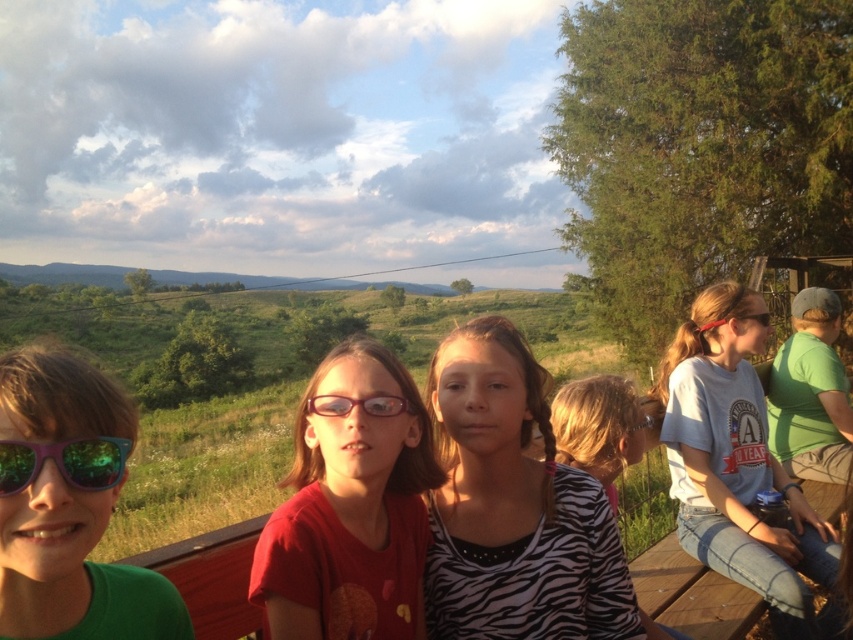
You are a photographer trying to capture a photo of the zebra print shirt at center and the matte green sunglasses at left. Since you want to ensure both are clearly visible, which object should you focus on first considering their sizes?

The zebra print shirt at center is bigger than the matte green sunglasses at left, so you should focus on the zebra print shirt at center first as it is larger and will require more attention to capture details clearly.

You are a photographer trying to capture a closeup of the shiny green sunglasses at left and the pink plastic goggles at center. Based on their sizes, which object should you focus on first to ensure both are in frame without moving the camera?

The shiny green sunglasses at left is taller than the pink plastic goggles at center, so you should focus on the shiny green sunglasses at left first to accommodate its larger height in the frame.

You are a photographer trying to capture a photo of the children on the wooden bench. You notice the shiny green sunglasses at left and the pink plastic goggles at center. Which object is positioned lower relative to the other?

The shiny green sunglasses at left is below the pink plastic goggles at center, so it is positioned lower.